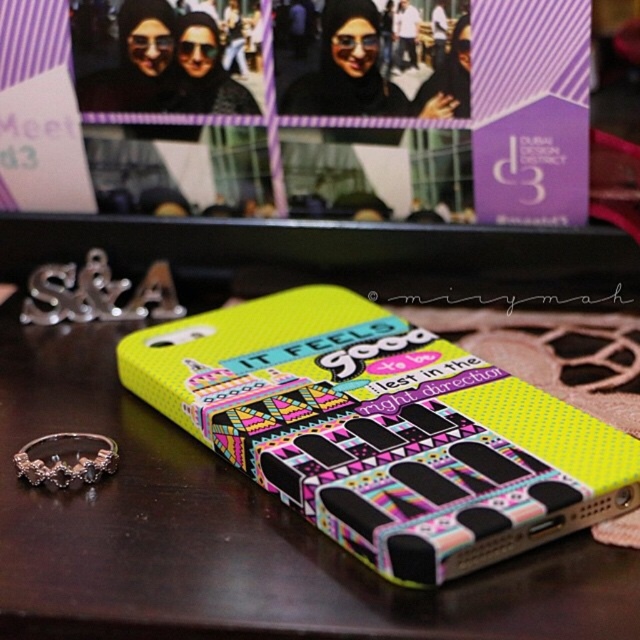
You are designing a custom phone case and want to add a border around the silver metallic letters at center. The border must be 1 cm wide on all sides. Given the current dimensions, will the border fit without overlapping the edges of the neon yellow textured phone case at center?

The neon yellow textured phone case at center is wider than the silver metallic letters at center. Since the border is only 1 cm wide on all sides, it should fit within the phone case without overlapping the edges as long as there is sufficient space around the letters. However, the exact fit depends on the current spacing between the letters and the case edges, which isn not specified in the provided information.

You are standing at the point marked as point (500, 461). You want to place a 12 inch ruler on the dark wooden surface next to the vibrant phone case. Can you fit the ruler horizontally without overlapping the phone case?

The distance between you and the viewer is 38.37 inches. Since the ruler is only 12 inches long, there is sufficient space to place it horizontally next to the vibrant phone case without overlapping.